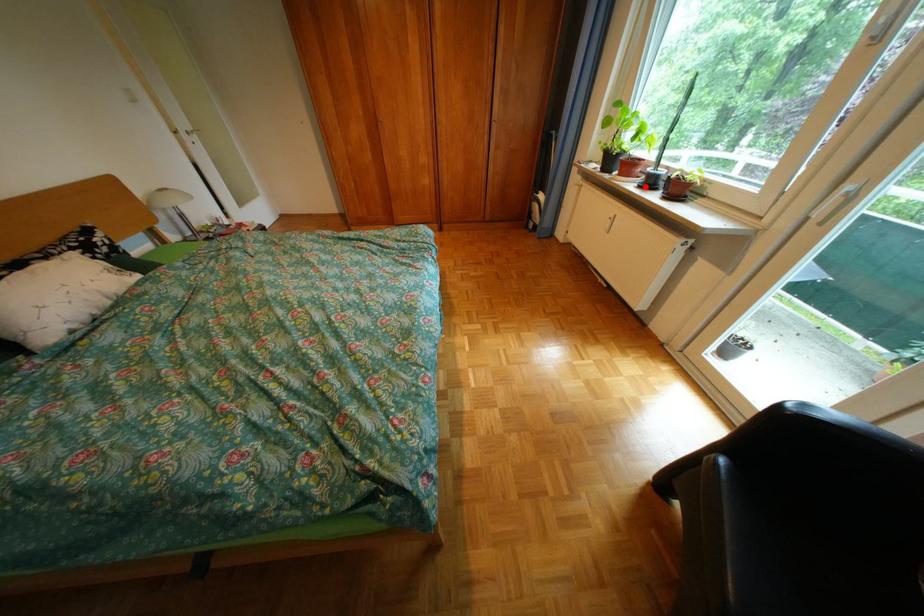
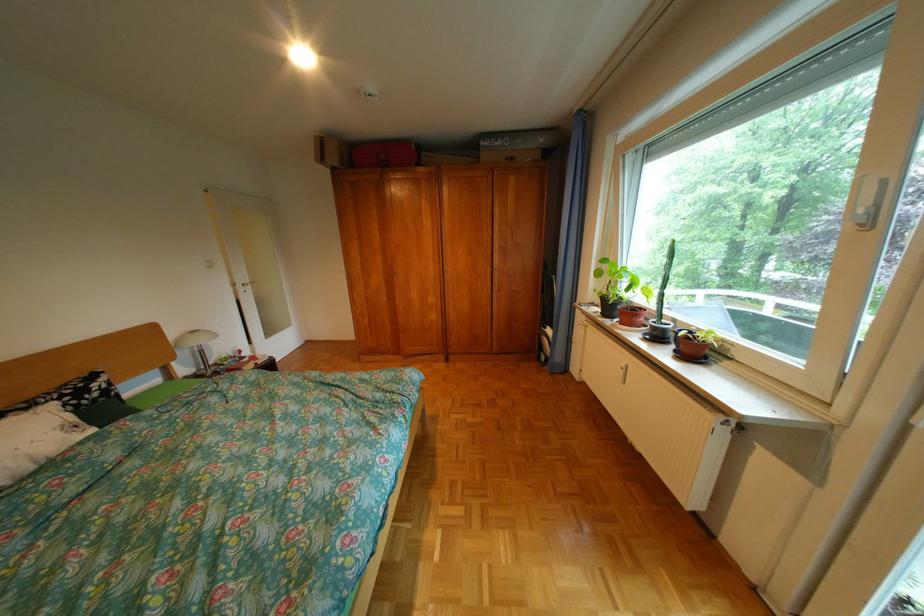
Question: I am providing you with two images of the same scene from different viewpoints. A red point is shown in image1. For the corresponding object point in image2, is it positioned nearer or farther from the camera?

Choices:
 (A) Nearer
 (B) Farther

Answer: (B)